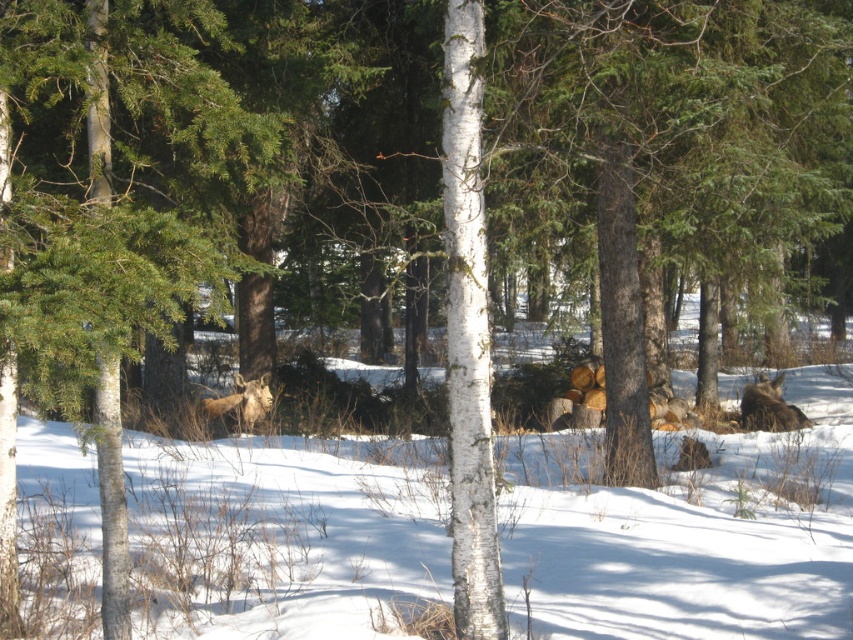
You are standing in the winter forest scene. There are two points marked in the image. The first point is at coordinates point (471, 289) and the second is at point (741, 388). Which point is closer to you?

Point (471, 289) is closer to the camera than point (741, 388).

You are standing at the origin point in the winter forest scene. You see two points marked in the image. If you want to move towards point point (743, 396) and point (248, 419), which point will you encounter first?

Point point (248, 419) will be encountered first because it is closer to the origin than point point (743, 396), which is further away.